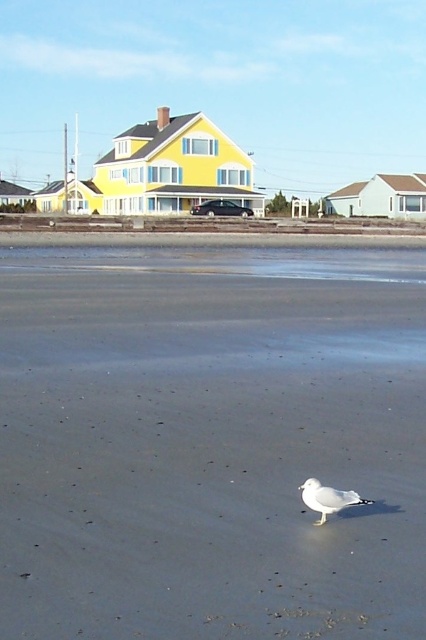
Question: Which point is farther to the camera?

Choices:
 (A) (331, 506)
 (B) (98, 544)

Answer: (A)

Question: From the image, what is the correct spatial relationship of smooth gray sand at center in relation to white matte bird at center?

Choices:
 (A) left
 (B) right

Answer: (A)

Question: Which point is farther from the camera taking this photo?

Choices:
 (A) (120, 637)
 (B) (324, 508)

Answer: (B)

Question: Does smooth gray sand at center have a greater width compared to white matte bird at center?

Choices:
 (A) no
 (B) yes

Answer: (B)

Question: Is smooth gray sand at center to the left of white matte bird at center from the viewer's perspective?

Choices:
 (A) yes
 (B) no

Answer: (A)